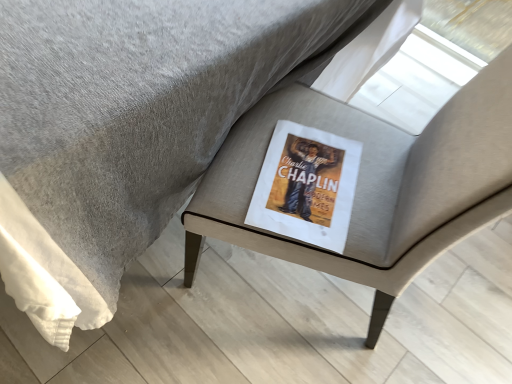
What do you see at coordinates (373, 184) in the screenshot? I see `matte gray cushion at center` at bounding box center [373, 184].

You are a GUI agent. You are given a task and a screenshot of the screen. Output one action in this format:
    pyautogui.click(x=<x>, y=<y>)
    Task: Click on the matte gray cushion at center
    Image resolution: width=512 pixels, height=384 pixels.
    Given the screenshot: What is the action you would take?
    pyautogui.click(x=373, y=184)

Locate an element on the screen. Image resolution: width=512 pixels, height=384 pixels. matte paper book at center is located at coordinates [306, 186].

In order to face matte paper book at center, should I rotate leftwards or rightwards?

To align with it, rotate right about 7.146°.

Describe the element at coordinates (306, 186) in the screenshot. I see `matte paper book at center` at that location.

This screenshot has height=384, width=512. Find the location of `matte gray cushion at center`. matte gray cushion at center is located at coordinates (373, 184).

Considering the relative positions of matte paper book at center and matte gray cushion at center in the image provided, is matte paper book at center to the left of matte gray cushion at center from the viewer's perspective?

Indeed, matte paper book at center is positioned on the left side of matte gray cushion at center.

Is matte paper book at center behind matte gray cushion at center?

Yes, matte paper book at center is further from the viewer.

Considering the points (322, 137) and (439, 153), which point is behind, point (322, 137) or point (439, 153)?

The point (322, 137) is farther.

From the image's perspective, which is below, matte paper book at center or matte gray cushion at center?

matte paper book at center.

From a real-world perspective, does matte paper book at center sit lower than matte gray cushion at center?

Yes, from a real-world perspective, matte paper book at center is below matte gray cushion at center.

Does matte paper book at center have a greater width compared to matte gray cushion at center?

In fact, matte paper book at center might be narrower than matte gray cushion at center.

In terms of height, does matte paper book at center look taller or shorter compared to matte gray cushion at center?

In the image, matte paper book at center appears to be shorter than matte gray cushion at center.

Is matte paper book at center smaller than matte gray cushion at center?

Yes.

Does matte paper book at center contain matte gray cushion at center?

No, matte gray cushion at center is not surrounded by matte paper book at center.

Consider the image. Would you consider matte paper book at center to be distant from matte gray cushion at center?

No, matte paper book at center is in close proximity to matte gray cushion at center.

Is matte paper book at center facing towards matte gray cushion at center?

Yes, matte paper book at center faces towards matte gray cushion at center.

Locate an element on the screen. chair located on the right of matte paper book at center is located at coordinates (373, 184).

Is matte gray cushion at center to the right of matte paper book at center from the viewer's perspective?

Yes.

Is the depth of matte gray cushion at center less than that of matte paper book at center?

Yes.

Between point (343, 259) and point (316, 170), which one is positioned in front?

Point (343, 259)

From the image's perspective, relative to matte paper book at center, is matte gray cushion at center above or below?

Clearly, from the image's perspective, matte gray cushion at center is above matte paper book at center.

From a real-world perspective, which is physically above, matte gray cushion at center or matte paper book at center?

From a 3D spatial view, matte gray cushion at center is above.

Between matte gray cushion at center and matte paper book at center, which one has smaller width?

Thinner between the two is matte paper book at center.

Considering the relative sizes of matte gray cushion at center and matte paper book at center in the image provided, is matte gray cushion at center shorter than matte paper book at center?

No, matte gray cushion at center is not shorter than matte paper book at center.

Can you confirm if matte gray cushion at center is bigger than matte paper book at center?

Yes, matte gray cushion at center is bigger than matte paper book at center.

Is matte paper book at center a part of matte gray cushion at center?

Absolutely, matte paper book at center is inside matte gray cushion at center.

Would you say matte gray cushion at center is a long distance from matte paper book at center?

They are positioned close to each other.

Is matte gray cushion at center facing towards matte paper book at center?

Yes, matte gray cushion at center faces towards matte paper book at center.

What's the angular difference between matte gray cushion at center and matte paper book at center's facing directions?

They differ by 94.3 degrees in their facing directions.

Where is `chair in front of the matte paper book at center`? The width and height of the screenshot is (512, 384). chair in front of the matte paper book at center is located at coordinates tap(373, 184).

You are a GUI agent. You are given a task and a screenshot of the screen. Output one action in this format:
    pyautogui.click(x=<x>, y=<y>)
    Task: Click on the chair that appears on the right of matte paper book at center
    The image size is (512, 384).
    Given the screenshot: What is the action you would take?
    pyautogui.click(x=373, y=184)

The image size is (512, 384). I want to click on chair in front of the matte paper book at center, so click(373, 184).